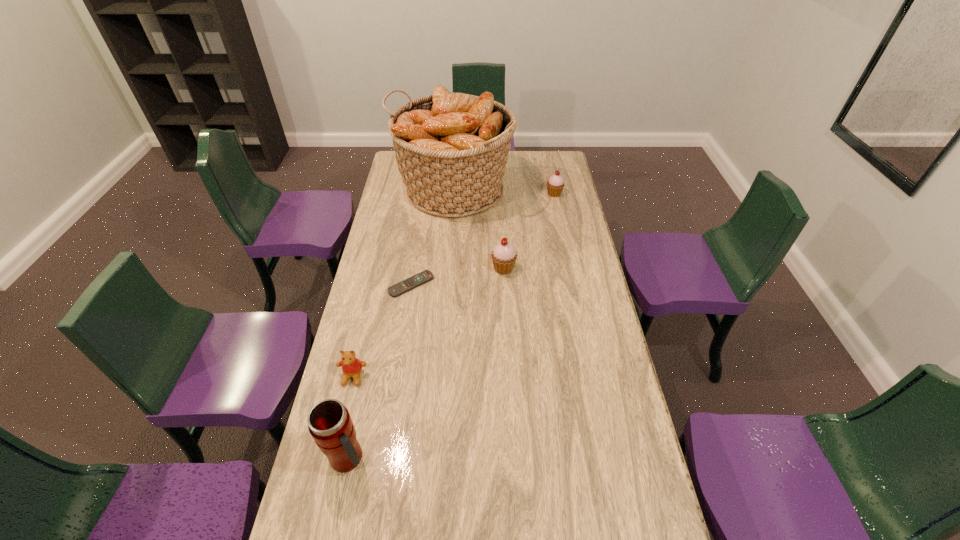
You are a GUI agent. You are given a task and a screenshot of the screen. Output one action in this format:
    pyautogui.click(x=<x>, y=<y>)
    Task: Click on the free area in between the shortest object and the farther cupcake
    This screenshot has height=540, width=960.
    Given the screenshot: What is the action you would take?
    pyautogui.click(x=483, y=239)

Identify the location of blank region between the shortest object and the rightmost object. This screenshot has width=960, height=540. (483, 239).

This screenshot has height=540, width=960. I want to click on vacant space that's between the second tallest object and the remote control, so click(x=380, y=372).

You are a GUI agent. You are given a task and a screenshot of the screen. Output one action in this format:
    pyautogui.click(x=<x>, y=<y>)
    Task: Click on the vacant point located between the shorter cupcake and the teddy bear
    The image size is (960, 540).
    Given the screenshot: What is the action you would take?
    pyautogui.click(x=453, y=285)

Where is `vacant area that lies between the left cupcake and the shortest object`? The width and height of the screenshot is (960, 540). vacant area that lies between the left cupcake and the shortest object is located at coordinates (457, 276).

Identify which object is the closest to the teddy bear. Please provide its 2D coordinates. Your answer should be formatted as a tuple, i.e. [(x, y)], where the tuple contains the x and y coordinates of a point satisfying the conditions above.

[(329, 422)]

Where is `object that is the fifth closest to the rightmost object`? The height and width of the screenshot is (540, 960). object that is the fifth closest to the rightmost object is located at coordinates (329, 422).

Find the location of a particular element. This screenshot has width=960, height=540. vacant region that satisfies the following two spatial constraints: 1. on the back side of the shorter cupcake; 2. on the left side of the third tallest object is located at coordinates (499, 194).